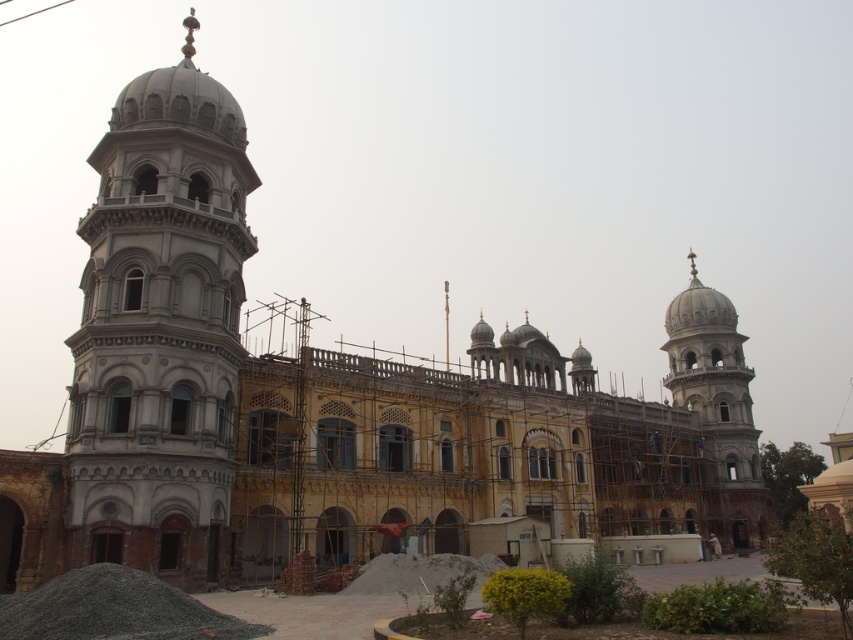
Question: Can you confirm if white stone tower at left is bigger than white marble tower at right?

Choices:
 (A) yes
 (B) no

Answer: (B)

Question: Which of the following is the closest to the observer?

Choices:
 (A) (708, 362)
 (B) (177, 364)

Answer: (B)

Question: Is white stone tower at left bigger than white marble tower at right?

Choices:
 (A) yes
 (B) no

Answer: (B)

Question: Is white stone tower at left smaller than white marble tower at right?

Choices:
 (A) no
 (B) yes

Answer: (B)

Question: Which point is farther from the camera taking this photo?

Choices:
 (A) 718,381
 (B) 219,218

Answer: (A)